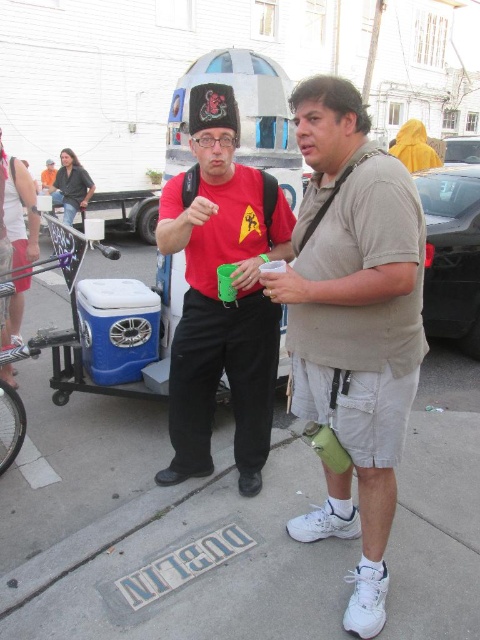
Please describe the exact 2D coordinates of the green fabric water bottle at center in the image coordinate system where the origin is at the bottom left corner of the image. The coordinates should be in the format of a tuple with two decimal numbers between 0 and 1, representing the x and y positions respectively. The x increases to the right and y increases upward.

The green fabric water bottle at center is located at coordinates approximately at point (x=352, y=326).

You are standing in the middle of the street and want to take a photo that includes both the person on the left and the person on the right. Which of the two points, point (226, 129) or point (71, 330), is closer to your camera position?

Point (226, 129) is closer to the camera than point (71, 330).